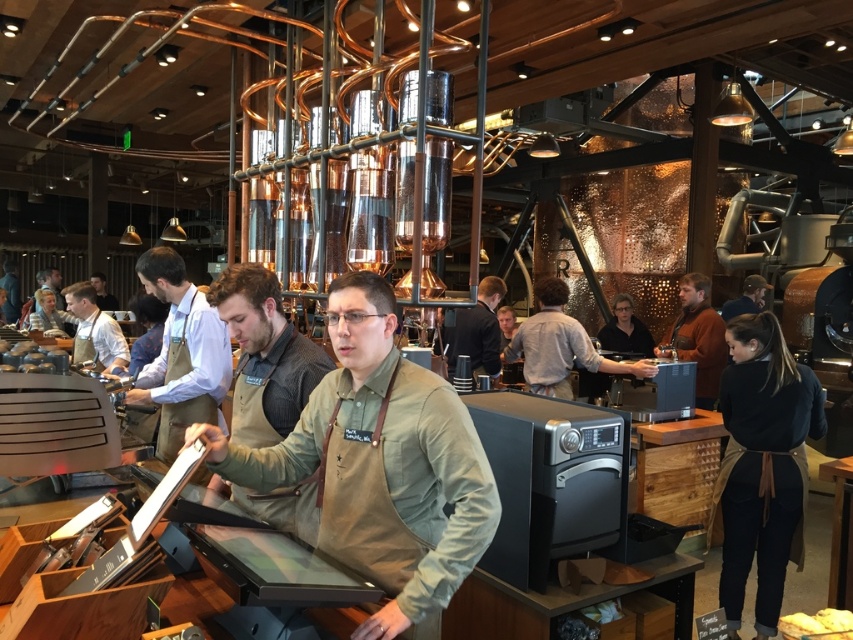
Question: Which point appears farthest from the camera in this image?

Choices:
 (A) (198, 300)
 (B) (547, 305)

Answer: (B)

Question: Is tan apron at center wider than white bread at lower right?

Choices:
 (A) no
 (B) yes

Answer: (B)

Question: Which object appears farthest from the camera in this image?

Choices:
 (A) light brown leather jacket at center
 (B) dark brown leather jacket at center
 (C) brown leather jacket at upper right
 (D) black fabric apron at right

Answer: (C)

Question: Can you confirm if tan apron at center is positioned above matte khaki apron at left?

Choices:
 (A) yes
 (B) no

Answer: (B)

Question: Is white bread at lower right wider than matte black apron at center?

Choices:
 (A) no
 (B) yes

Answer: (A)

Question: Which point is farther from the camera taking this photo?

Choices:
 (A) (708, 332)
 (B) (809, 621)
 (C) (97, 326)
 (D) (476, 316)

Answer: (C)